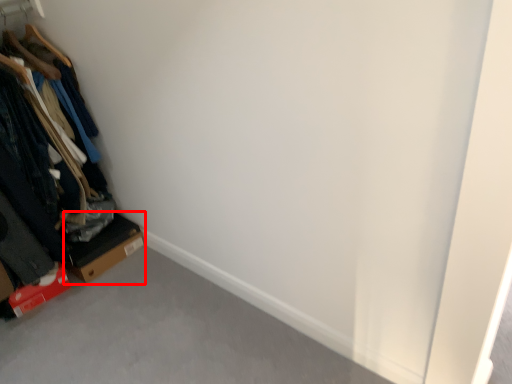
Question: From the image's perspective, what is the correct spatial positioning of cardboard box (annotated by the red box) in reference to furniture?

Choices:
 (A) below
 (B) above

Answer: (A)